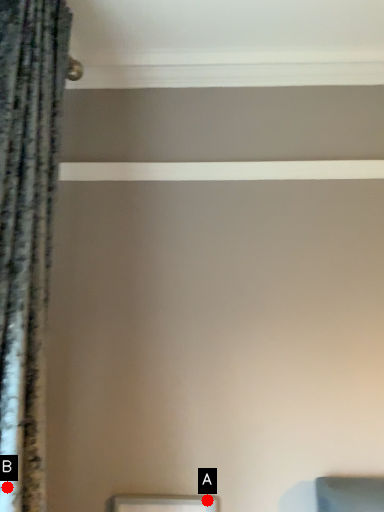
Question: Two points are circled on the image, labeled by A and B beside each circle. Which of the following is the closest to the observer?

Choices:
 (A) A is closer
 (B) B is closer

Answer: (B)